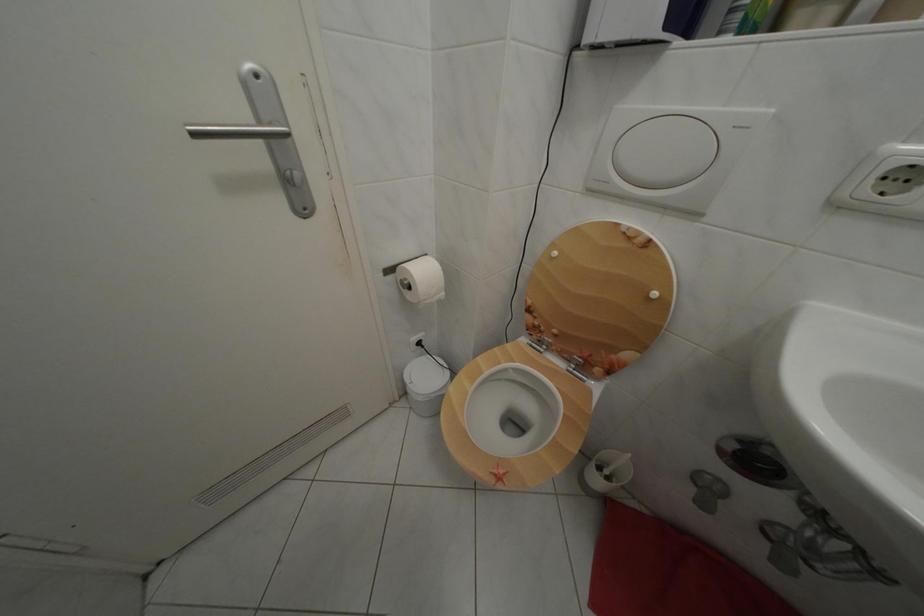
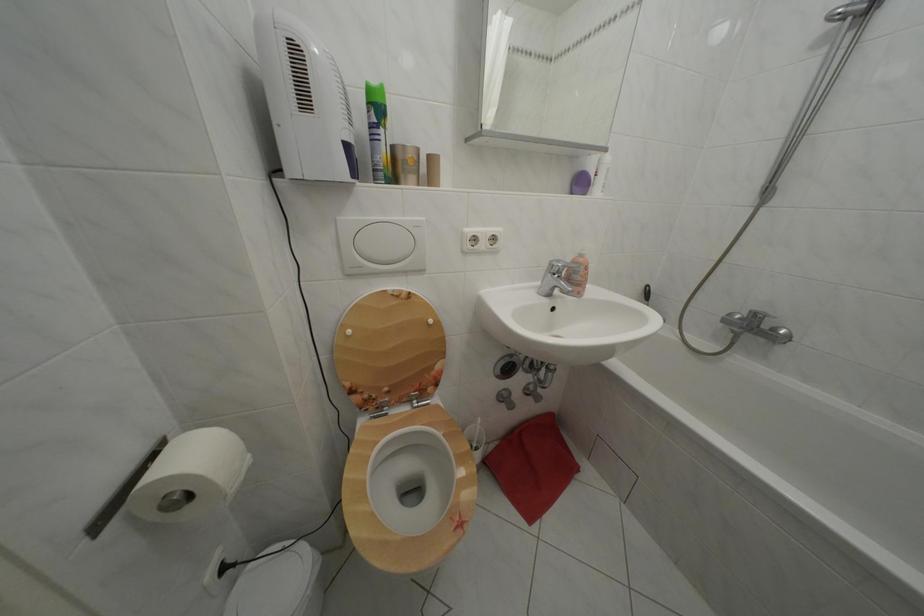
Where in the second image is the point corresponding to (x=419, y=294) from the first image?

(198, 504)